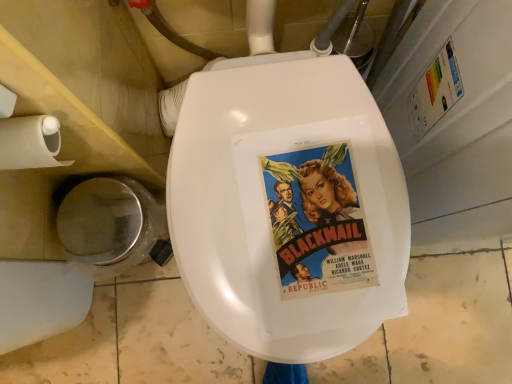
The height and width of the screenshot is (384, 512). In order to click on vacant region above vivid paper poster at center (from a real-world perspective) in this screenshot , I will do `click(313, 217)`.